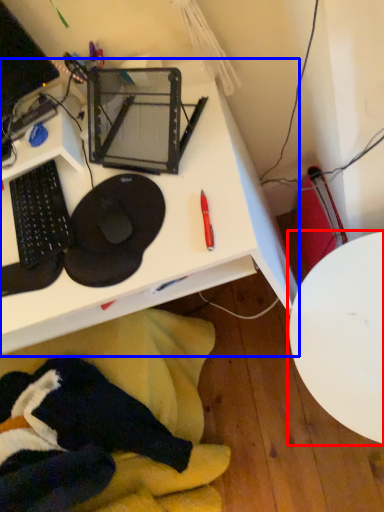
Question: Which object is further to the camera taking this photo, table (highlighted by a red box) or desk (highlighted by a blue box)?

Choices:
 (A) table
 (B) desk

Answer: (A)